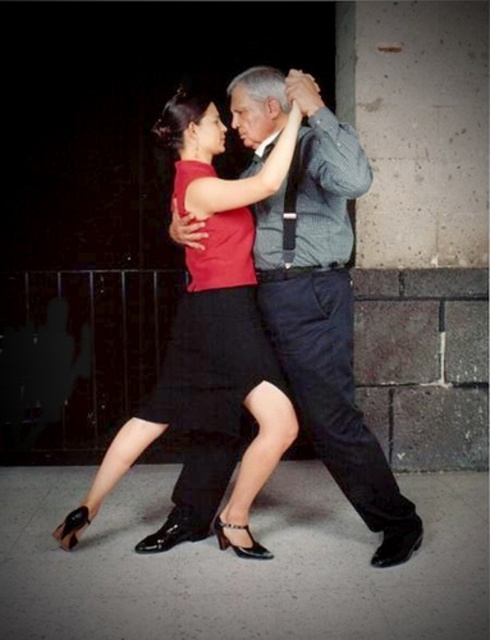
Question: Which object is closer to the camera taking this photo?

Choices:
 (A) matte red blouse at center
 (B) matte gray shirt at center
 (C) matte red dress at center

Answer: (B)

Question: Considering the relative positions of matte gray shirt at center and matte red blouse at center in the image provided, where is matte gray shirt at center located with respect to matte red blouse at center?

Choices:
 (A) above
 (B) below

Answer: (A)

Question: Which object is closer to the camera taking this photo?

Choices:
 (A) matte gray shirt at center
 (B) matte red blouse at center
 (C) matte red dress at center

Answer: (A)

Question: Which object is closer to the camera taking this photo?

Choices:
 (A) matte red blouse at center
 (B) matte red dress at center

Answer: (A)

Question: Is matte gray shirt at center closer to camera compared to matte red dress at center?

Choices:
 (A) yes
 (B) no

Answer: (A)

Question: Is matte gray shirt at center positioned in front of matte red blouse at center?

Choices:
 (A) yes
 (B) no

Answer: (A)